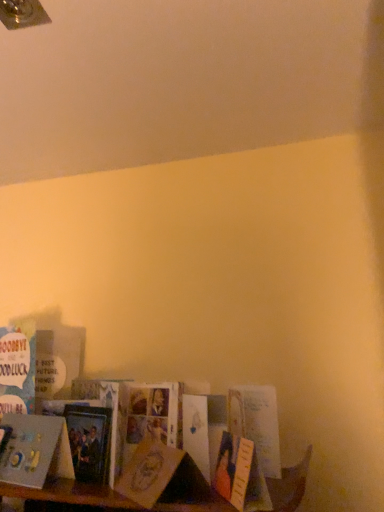
Question: From the image's perspective, is white matte card at lower left, placed as the first book when sorted from front to back, located above matte paper card at lower left, marked as the 2th paperback book in a left-to-right arrangement?

Choices:
 (A) no
 (B) yes

Answer: (A)

Question: Does white matte card at lower left, positioned as the 2th book in back-to-front order, appear on the right side of matte paper card at lower left, which ranks as the second paperback book in back-to-front order?

Choices:
 (A) no
 (B) yes

Answer: (A)

Question: Can we say white matte card at lower left, positioned as the 2th book in back-to-front order, lies outside matte paper card at lower left, which is the 1th paperback book from right to left?

Choices:
 (A) no
 (B) yes

Answer: (B)

Question: Could you tell me if white matte card at lower left, positioned as the 2th book in back-to-front order, is facing matte paper card at lower left, marked as the 2th paperback book in a left-to-right arrangement?

Choices:
 (A) yes
 (B) no

Answer: (B)

Question: From the image's perspective, is white matte card at lower left, placed as the first book when sorted from front to back, under matte paper card at lower left, which is the 1th paperback book from right to left?

Choices:
 (A) yes
 (B) no

Answer: (A)

Question: Is there a large distance between white matte card at lower left, placed as the first book when sorted from front to back, and matte paper card at lower left, marked as the 2th paperback book in a left-to-right arrangement?

Choices:
 (A) yes
 (B) no

Answer: (B)

Question: From a real-world perspective, is blue paper card at lower left, which is the 2th book from front to back, on top of white matte card at lower left, placed as the first book when sorted from front to back?

Choices:
 (A) no
 (B) yes

Answer: (B)

Question: From a real-world perspective, is blue paper card at lower left, which is the first book from back to front, located beneath white matte card at lower left, placed as the first book when sorted from front to back?

Choices:
 (A) yes
 (B) no

Answer: (B)

Question: Is blue paper card at lower left, which is the 2th book from front to back, positioned in front of white matte card at lower left, positioned as the 2th book in back-to-front order?

Choices:
 (A) no
 (B) yes

Answer: (A)

Question: Is blue paper card at lower left, which is the first book from back to front, shorter than white matte card at lower left, placed as the first book when sorted from front to back?

Choices:
 (A) yes
 (B) no

Answer: (B)

Question: Considering the relative sizes of blue paper card at lower left, which is the first book from back to front, and white matte card at lower left, placed as the first book when sorted from front to back, in the image provided, is blue paper card at lower left, which is the first book from back to front, thinner than white matte card at lower left, placed as the first book when sorted from front to back,?

Choices:
 (A) yes
 (B) no

Answer: (A)

Question: Is blue paper card at lower left, which is the 2th book from front to back, bigger than white matte card at lower left, positioned as the 2th book in back-to-front order?

Choices:
 (A) no
 (B) yes

Answer: (B)

Question: From the image's perspective, would you say matte paper card at lower left, which ranks as the second paperback book in back-to-front order, is shown under blue paper card at lower left, which is the 2th book from front to back?

Choices:
 (A) no
 (B) yes

Answer: (B)